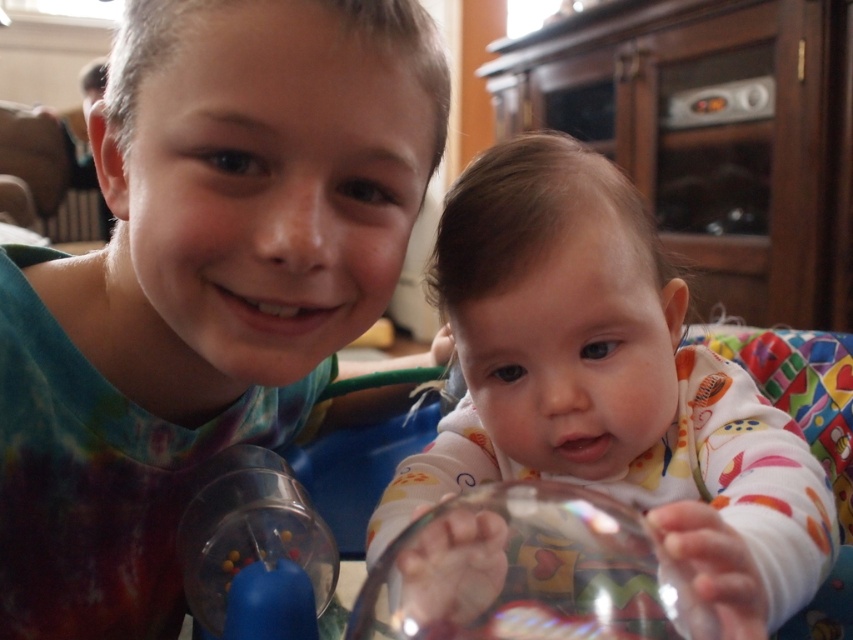
Question: Which point is closer to the camera?

Choices:
 (A) (457, 324)
 (B) (426, 579)
 (C) (96, 624)

Answer: (B)

Question: Is tie-dye fabric shirt at left behind transparent glass bowl at lower center?

Choices:
 (A) no
 (B) yes

Answer: (B)

Question: Which point is farther to the camera?

Choices:
 (A) (521, 404)
 (B) (659, 628)

Answer: (A)

Question: Where is tie-dye fabric shirt at left located in relation to white soft baby at center in the image?

Choices:
 (A) left
 (B) right

Answer: (A)

Question: Based on their relative distances, which object is farther from the transparent glass bowl at lower center?

Choices:
 (A) white soft baby at center
 (B) tie-dye fabric shirt at left

Answer: (B)

Question: Can you confirm if tie-dye fabric shirt at left is thinner than transparent glass bowl at lower center?

Choices:
 (A) yes
 (B) no

Answer: (B)